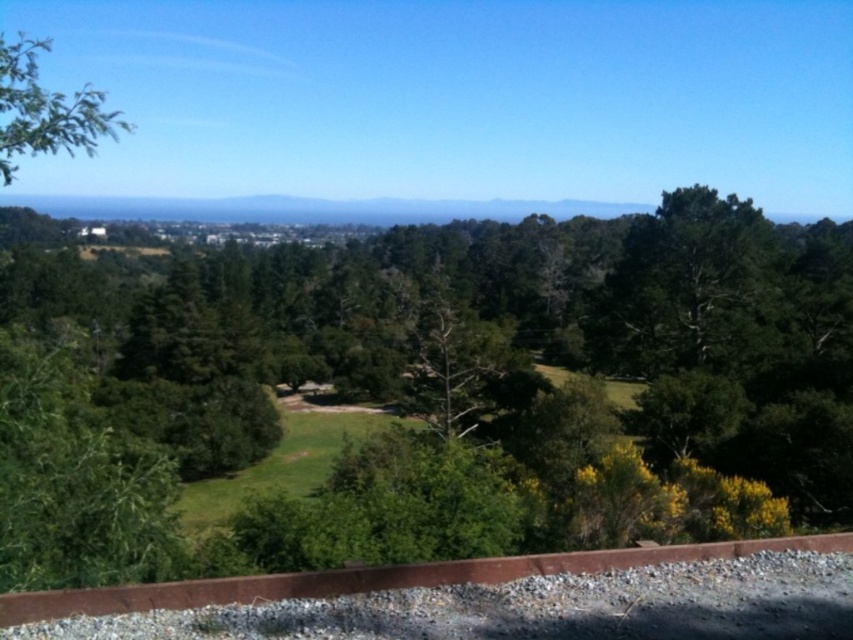
You are standing on the dirt path and want to walk towards the green leafy tree at center. However, there is another green leafy tree at upper left in your way. Can you see the tree you want to walk to from your current position?

The green leafy tree at center is positioned under the green leafy tree at upper left, so you cannot see the green leafy tree at center because it is blocked by the green leafy tree at upper left.